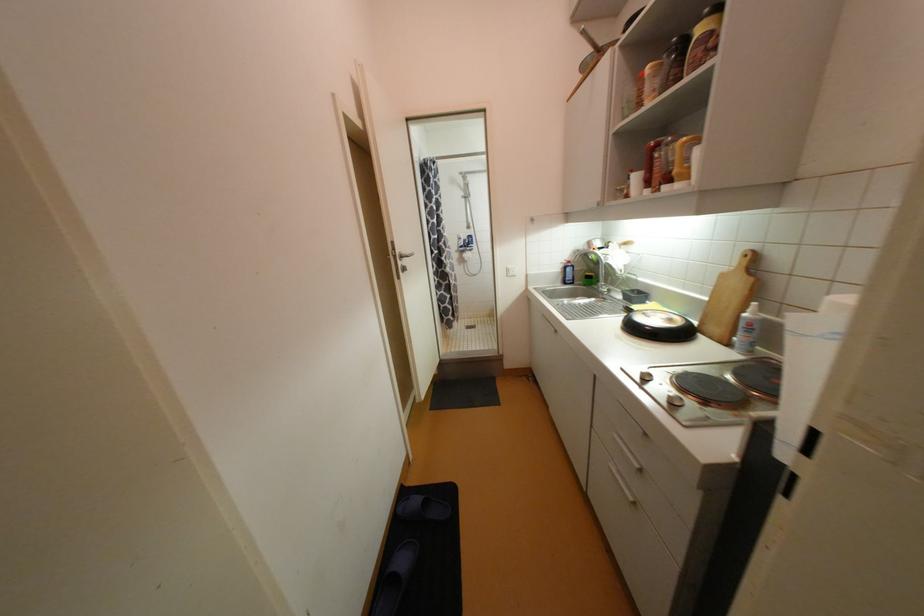
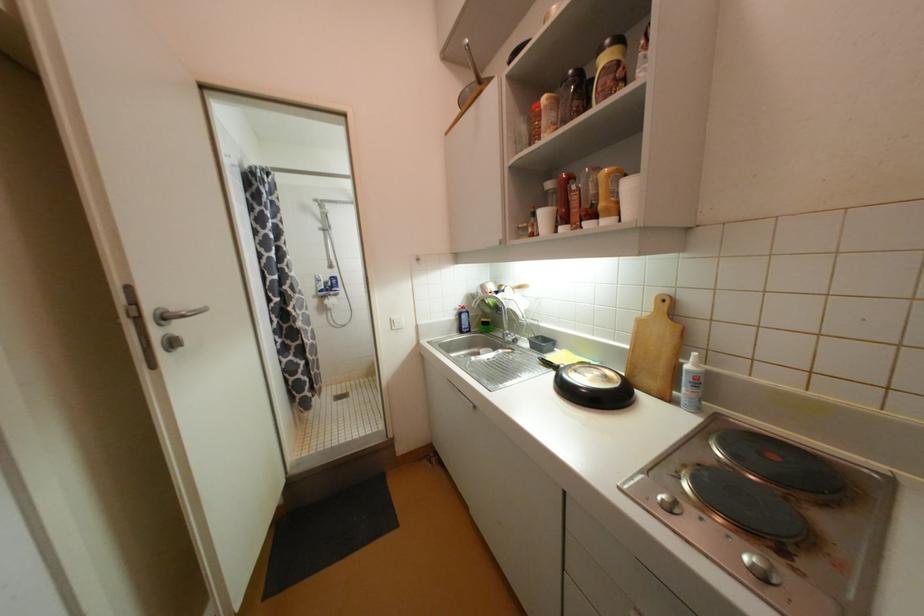
Find the pixel in the second image that matches point (709, 49) in the first image.

(616, 78)